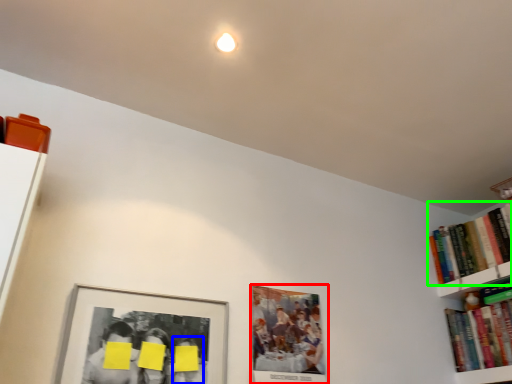
Question: Which object is positioned closest to picture frame (highlighted by a red box)? Select from person (highlighted by a blue box) and book (highlighted by a green box).

Choices:
 (A) person
 (B) book

Answer: (A)